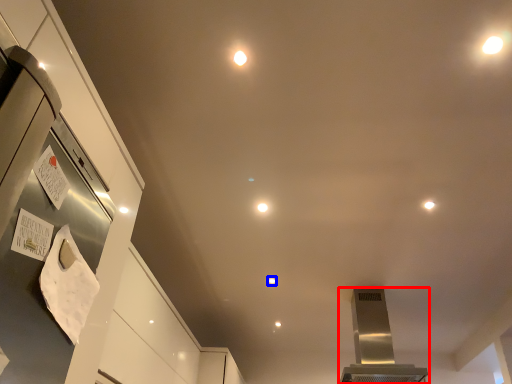
Question: Which of the following is the closest to the observer, home appliance (highlighted by a red box) or light (highlighted by a blue box)?

Choices:
 (A) home appliance
 (B) light

Answer: (A)